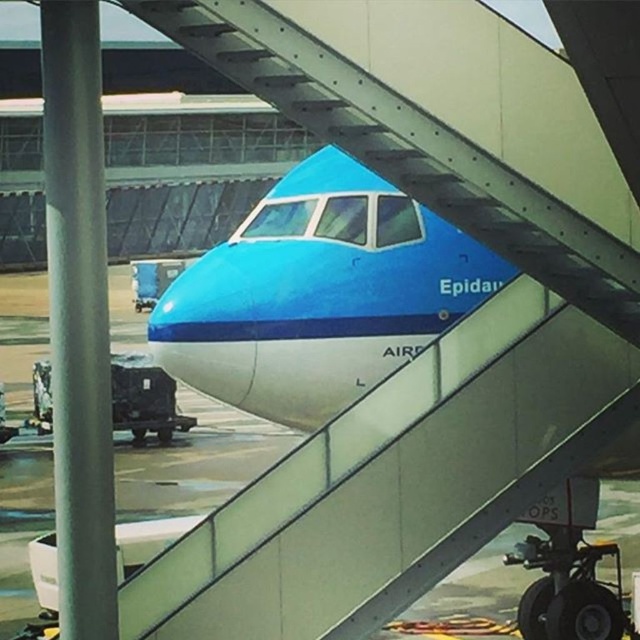
You are standing at the airport gate and see the blue glossy airplane at center and the metallic gray staircase at center. Which object is closer to you?

The blue glossy airplane at center is closer to you than the metallic gray staircase at center.

You are standing at the airport gate and see the airplane. Where is the point located at coordinates (x=317, y=294) in relation to the blue glossy airplane at center?

The point at coordinates (x=317, y=294) corresponds to the blue glossy airplane at center.

You are standing at the airport gate and see the blue glossy airplane at center. If you want to board the airplane, which direction should you walk towards?

You should walk towards the blue glossy airplane at center as it is located at point (x=317, y=294) which is the center of the scene.